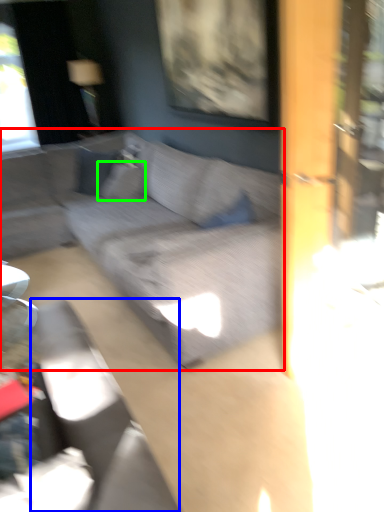
Question: Considering the real-world distances, which object is closest to studio couch (highlighted by a red box)? swivel chair (highlighted by a blue box) or pillow (highlighted by a green box).

Choices:
 (A) swivel chair
 (B) pillow

Answer: (B)